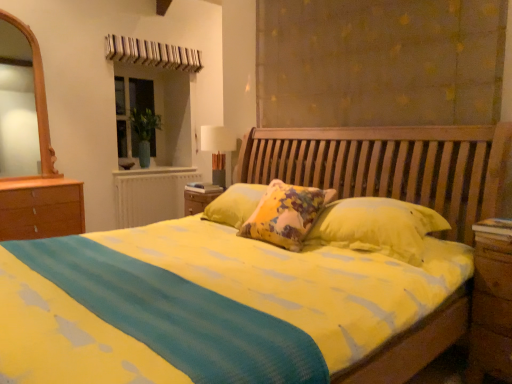
Question: Is white fabric lampshade at upper center to the right of white painted radiator at center from the viewer's perspective?

Choices:
 (A) no
 (B) yes

Answer: (B)

Question: Considering the relative sizes of white fabric lampshade at upper center and white painted radiator at center in the image provided, is white fabric lampshade at upper center shorter than white painted radiator at center?

Choices:
 (A) no
 (B) yes

Answer: (B)

Question: Is white fabric lampshade at upper center smaller than white painted radiator at center?

Choices:
 (A) yes
 (B) no

Answer: (A)

Question: Does white fabric lampshade at upper center come behind white painted radiator at center?

Choices:
 (A) yes
 (B) no

Answer: (B)

Question: From the image's perspective, does white fabric lampshade at upper center appear lower than white painted radiator at center?

Choices:
 (A) no
 (B) yes

Answer: (A)

Question: Are white fabric lampshade at upper center and white painted radiator at center far apart?

Choices:
 (A) no
 (B) yes

Answer: (B)

Question: Is matte brown curtain at upper center further to the viewer compared to green glass vase at upper left?

Choices:
 (A) yes
 (B) no

Answer: (B)

Question: Would you consider matte brown curtain at upper center to be distant from green glass vase at upper left?

Choices:
 (A) no
 (B) yes

Answer: (B)

Question: Can you confirm if matte brown curtain at upper center is bigger than green glass vase at upper left?

Choices:
 (A) no
 (B) yes

Answer: (B)

Question: Does matte brown curtain at upper center have a smaller size compared to green glass vase at upper left?

Choices:
 (A) no
 (B) yes

Answer: (A)

Question: From a real-world perspective, is matte brown curtain at upper center located higher than green glass vase at upper left?

Choices:
 (A) no
 (B) yes

Answer: (B)

Question: Is matte brown curtain at upper center shorter than green glass vase at upper left?

Choices:
 (A) no
 (B) yes

Answer: (B)

Question: Is green glass vase at upper left looking in the opposite direction of matte brown curtain at upper center?

Choices:
 (A) no
 (B) yes

Answer: (A)